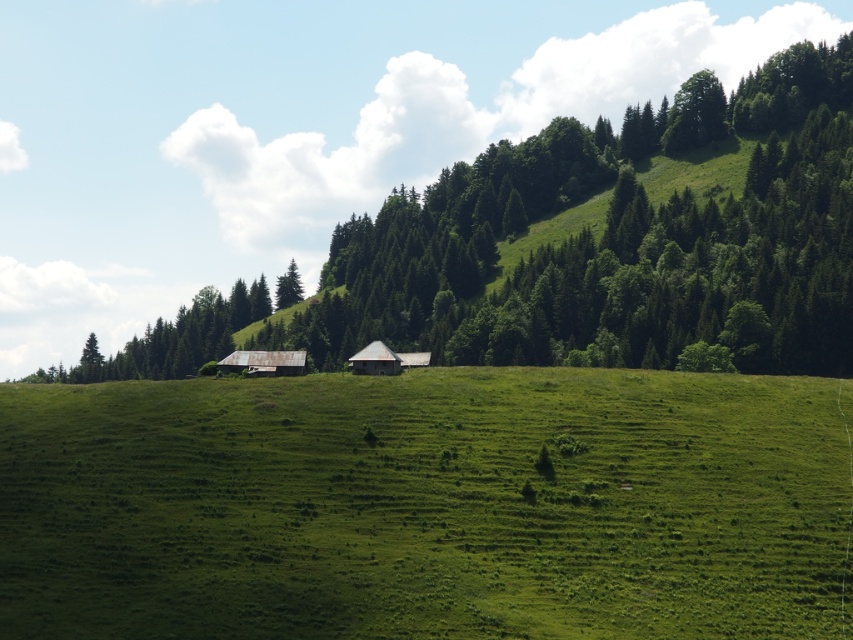
Question: Is green grassy field at center to the left of rusty metal barn at center from the viewer's perspective?

Choices:
 (A) no
 (B) yes

Answer: (A)

Question: Is green matte tree at center thinner than rustic wooden barn at center?

Choices:
 (A) no
 (B) yes

Answer: (A)

Question: Is green grassy field at center bigger than green matte tree at center?

Choices:
 (A) no
 (B) yes

Answer: (A)

Question: Which point is closer to the camera taking this photo?

Choices:
 (A) (404, 353)
 (B) (154, 376)
 (C) (273, 369)
 (D) (358, 488)

Answer: (D)

Question: Among these points, which one is farthest from the camera?

Choices:
 (A) pos(381,522)
 (B) pos(231,352)
 (C) pos(392,360)
 (D) pos(61,365)

Answer: (D)

Question: Which point appears closest to the camera in this image?

Choices:
 (A) (242, 353)
 (B) (676, 344)

Answer: (A)